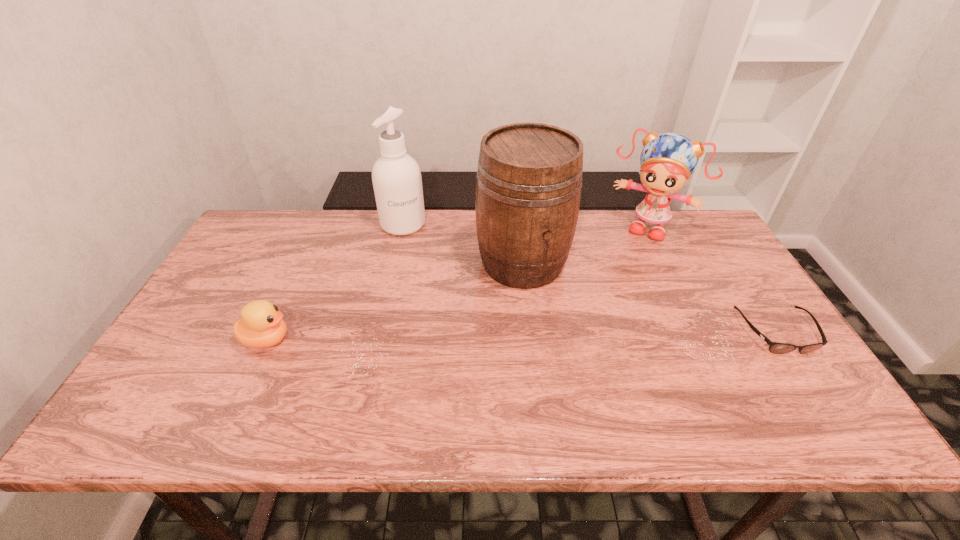
Find the location of a particular element. free space on the desktop that is between the fourth tallest object and the sunglasses and is positioned on the side of the cider near the bung hole is located at coordinates click(565, 335).

Identify the location of free space on the desktop that is between the fourth tallest object and the sunglasses and is positioned on the front label of the fourth object from right to left. (451, 337).

The height and width of the screenshot is (540, 960). Identify the location of free space on the desktop that is between the leftmost object and the shortest object and is positioned on the face of the third tallest object. (595, 335).